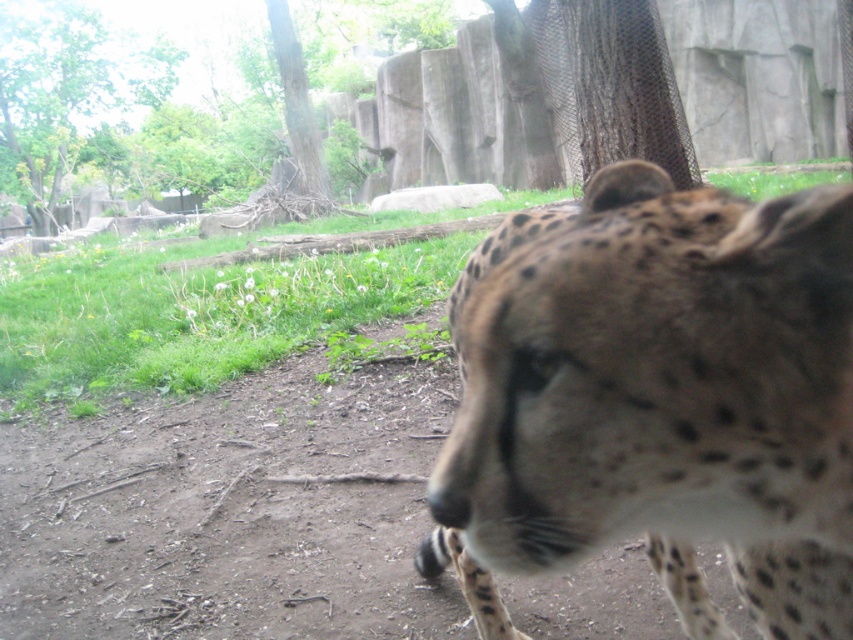
Who is more distant from viewer, (788, 589) or (54, 147)?

The point (54, 147) is more distant.

How distant is spotted fur cheetah at center from green leafy tree at upper left?

The distance of spotted fur cheetah at center from green leafy tree at upper left is 85.93 feet.

Which is in front, point (822, 602) or point (28, 19)?

Point (822, 602) is more forward.

Where is `spotted fur cheetah at center`? The height and width of the screenshot is (640, 853). spotted fur cheetah at center is located at coordinates (657, 394).